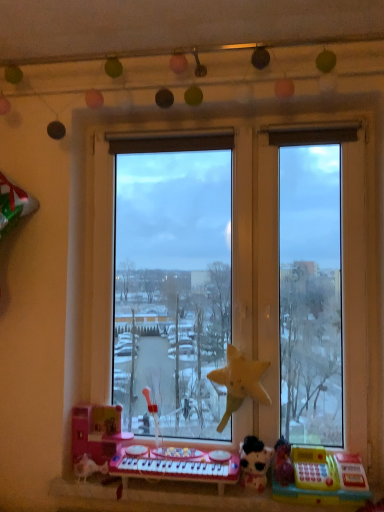
Where is `blank space above transparent glass window at center (from a real-world perspective)`? blank space above transparent glass window at center (from a real-world perspective) is located at coordinates (223, 118).